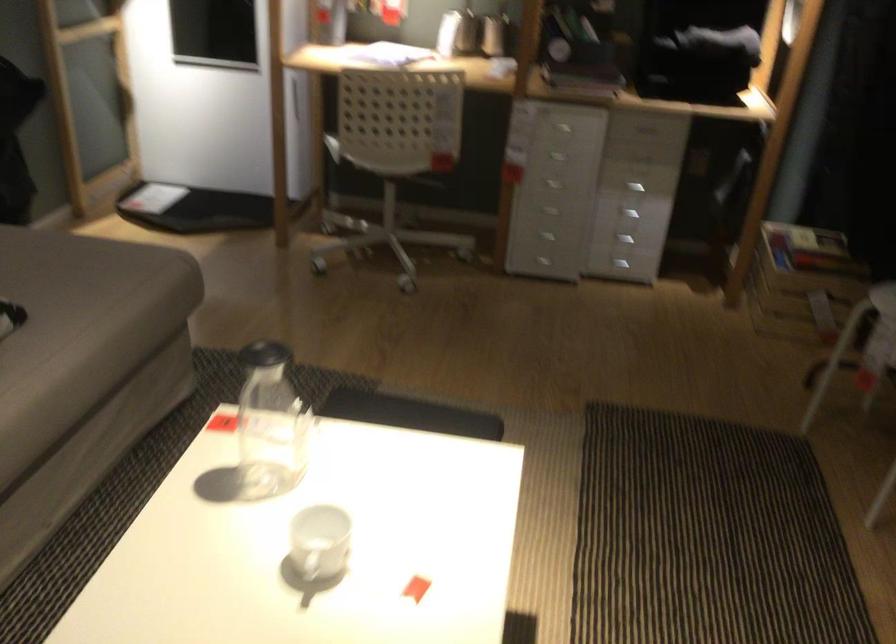
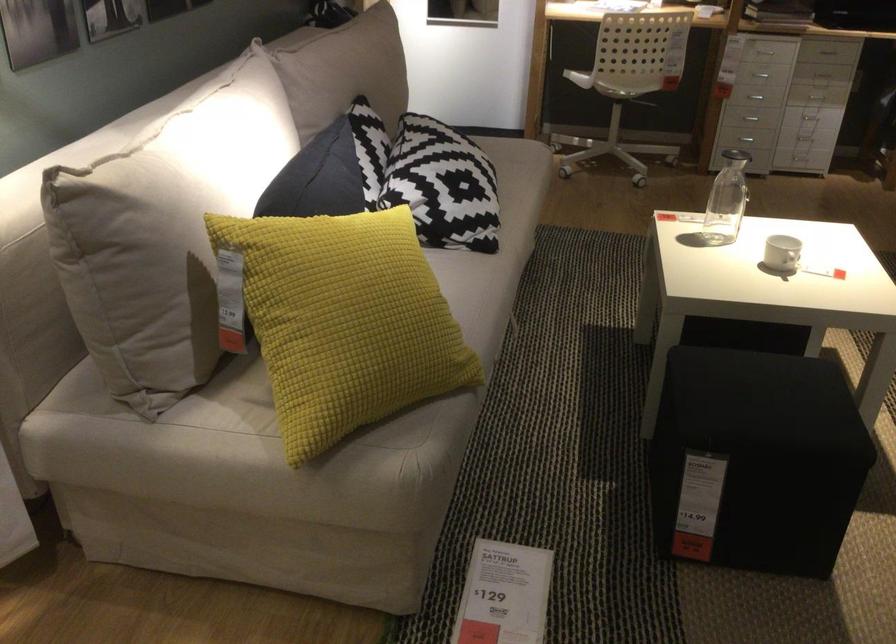
Find the pixel in the second image that matches (612,210) in the first image.

(815, 96)